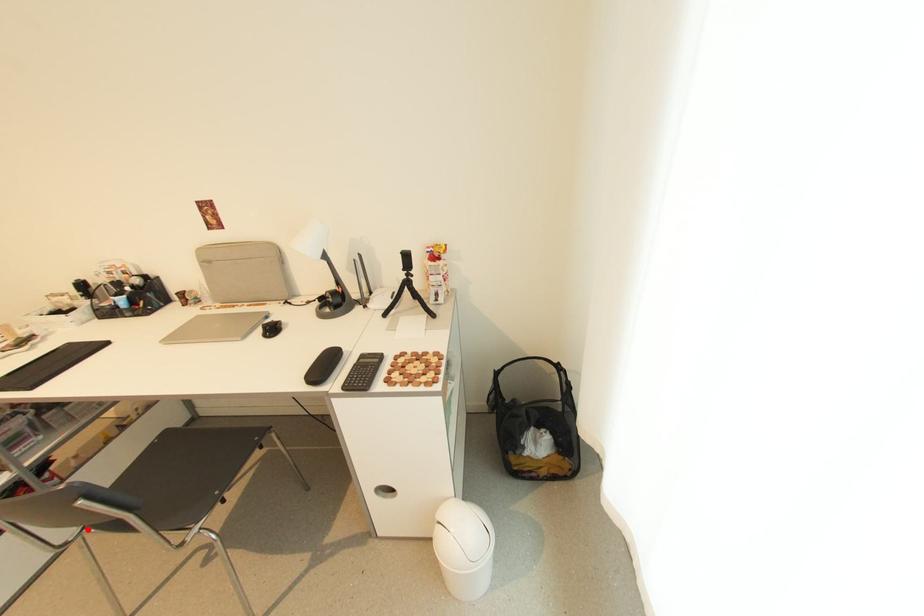
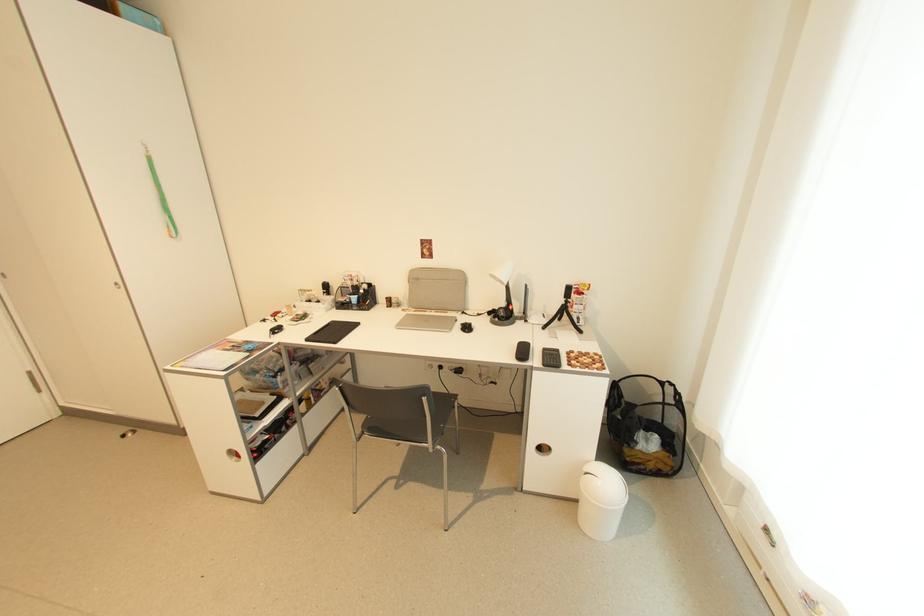
Question: I am providing you with two images of the same scene from different viewpoints. Image1 has a red point marked. In image2, the corresponding 3D location appears at what relative position? Reply with the corresponding letter.

Choices:
 (A) Closer
 (B) Farther

Answer: (B)